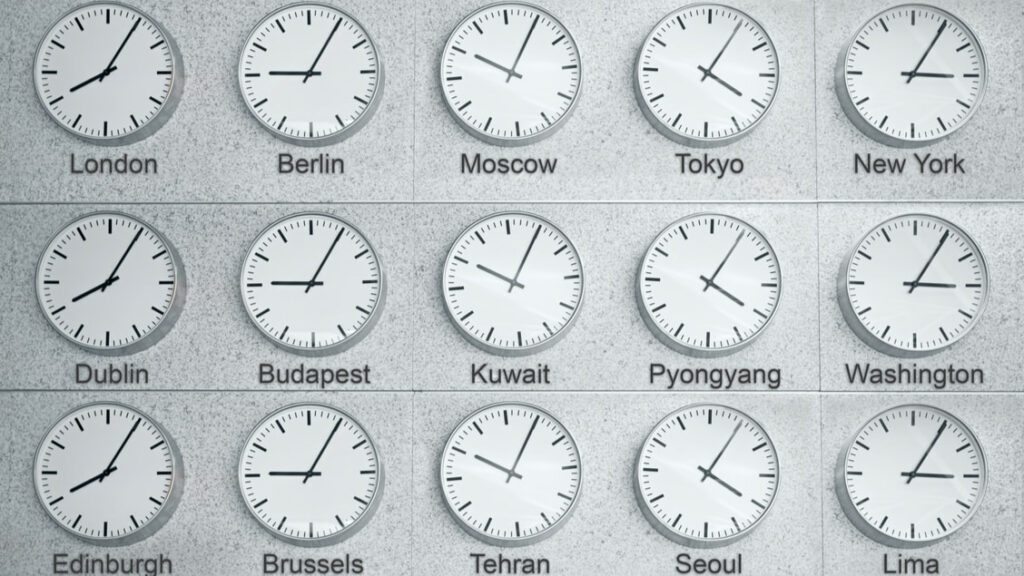
You are a GUI agent. You are given a task and a screenshot of the screen. Output one action in this format:
    pyautogui.click(x=<x>, y=<y>)
    Task: Click on the clock
    
    Given the screenshot: What is the action you would take?
    pyautogui.click(x=299, y=96)